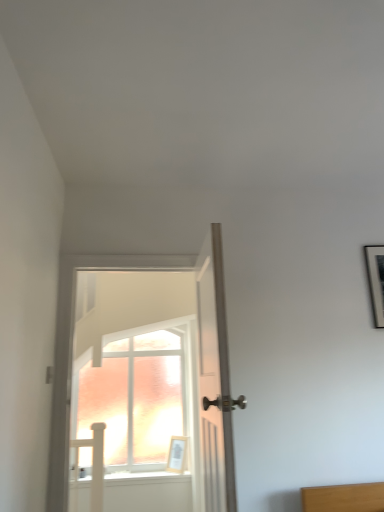
Question: Is the surface of white glossy door at center, acting as the 1th door starting from the left, in direct contact with white wooden door at center, the second door positioned from the left?

Choices:
 (A) yes
 (B) no

Answer: (B)

Question: Is white glossy door at center, the second door when ordered from right to left, outside white wooden door at center, which is the 1th door from right to left?

Choices:
 (A) no
 (B) yes

Answer: (B)

Question: Considering the relative sizes of white glossy door at center, acting as the 1th door starting from the left, and white wooden door at center, which is the 1th door from right to left, in the image provided, is white glossy door at center, acting as the 1th door starting from the left, shorter than white wooden door at center, which is the 1th door from right to left,?

Choices:
 (A) yes
 (B) no

Answer: (B)

Question: Is white glossy door at center, the second door when ordered from right to left, bigger than white wooden door at center, which is the 1th door from right to left?

Choices:
 (A) yes
 (B) no

Answer: (A)

Question: From the image's perspective, is white glossy door at center, the second door when ordered from right to left, located beneath white wooden door at center, which is the 1th door from right to left?

Choices:
 (A) yes
 (B) no

Answer: (A)

Question: Considering the positions of light wood picture frame at center and white wooden door at center, which is the 1th door from right to left, in the image, is light wood picture frame at center taller or shorter than white wooden door at center, which is the 1th door from right to left,?

Choices:
 (A) short
 (B) tall

Answer: (A)

Question: Does point (185, 441) appear closer or farther from the camera than point (200, 278)?

Choices:
 (A) farther
 (B) closer

Answer: (A)

Question: From the image's perspective, is light wood picture frame at center above or below white wooden door at center, which is the 1th door from right to left?

Choices:
 (A) below
 (B) above

Answer: (A)

Question: Is light wood picture frame at center inside or outside of white wooden door at center, the second door positioned from the left?

Choices:
 (A) outside
 (B) inside

Answer: (A)

Question: Is white glossy door at center, acting as the 1th door starting from the left, bigger or smaller than white wooden door at center, the second door positioned from the left?

Choices:
 (A) big
 (B) small

Answer: (A)

Question: Considering the relative positions of white glossy door at center, acting as the 1th door starting from the left, and white wooden door at center, the second door positioned from the left, in the image provided, is white glossy door at center, acting as the 1th door starting from the left, to the left or to the right of white wooden door at center, the second door positioned from the left,?

Choices:
 (A) left
 (B) right

Answer: (A)

Question: From a real-world perspective, is white glossy door at center, acting as the 1th door starting from the left, physically located above or below white wooden door at center, the second door positioned from the left?

Choices:
 (A) below
 (B) above

Answer: (B)

Question: Is white glossy door at center, the second door when ordered from right to left, in front of or behind white wooden door at center, which is the 1th door from right to left, in the image?

Choices:
 (A) front
 (B) behind

Answer: (B)

Question: From their relative heights in the image, would you say white glossy door at center, the second door when ordered from right to left, is taller or shorter than light wood picture frame at center?

Choices:
 (A) tall
 (B) short

Answer: (A)

Question: From a real-world perspective, is white glossy door at center, the second door when ordered from right to left, positioned above or below light wood picture frame at center?

Choices:
 (A) below
 (B) above

Answer: (B)